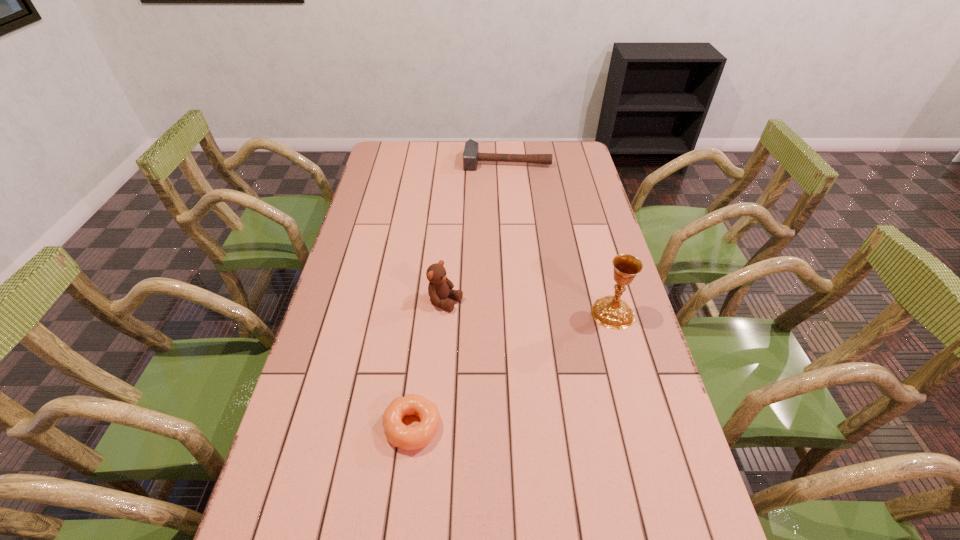
The width and height of the screenshot is (960, 540). I want to click on vacant space at the left edge of the desktop, so click(319, 340).

At what (x,y) coordinates should I click in order to perform the action: click on vacant space at the right edge of the desktop. Please return your answer as a coordinate pair (x, y). The image size is (960, 540). Looking at the image, I should click on (618, 407).

You are a GUI agent. You are given a task and a screenshot of the screen. Output one action in this format:
    pyautogui.click(x=<x>, y=<y>)
    Task: Click on the vacant space at the far left corner of the desktop
    This screenshot has height=540, width=960.
    Given the screenshot: What is the action you would take?
    pyautogui.click(x=384, y=147)

Image resolution: width=960 pixels, height=540 pixels. I want to click on vacant space that's between the nearest object and the second tallest object, so (x=429, y=364).

What are the coordinates of `free space between the farthest object and the rightmost object` in the screenshot? It's located at (560, 237).

Identify the location of free space that is in between the hammer and the tallest object. [x=560, y=237].

Where is `free spot between the hammer and the teddy bear`? Image resolution: width=960 pixels, height=540 pixels. free spot between the hammer and the teddy bear is located at coordinates (476, 232).

Identify the location of vacant point located between the second tallest object and the rightmost object. (529, 307).

Find the location of a particular element. The width and height of the screenshot is (960, 540). vacant region between the chalice and the nearest object is located at coordinates (513, 369).

You are a GUI agent. You are given a task and a screenshot of the screen. Output one action in this format:
    pyautogui.click(x=<x>, y=<y>)
    Task: Click on the unoccupied position between the shortest object and the rightmost object
    
    Given the screenshot: What is the action you would take?
    coord(513,369)